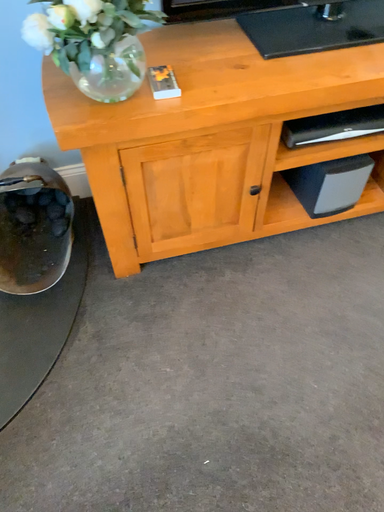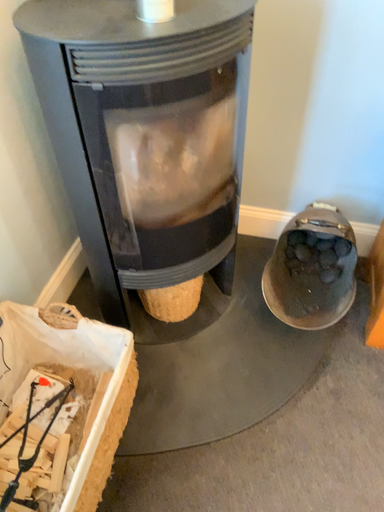
Question: Which way did the camera rotate in the video?

Choices:
 (A) rotated downward
 (B) rotated upward

Answer: (B)